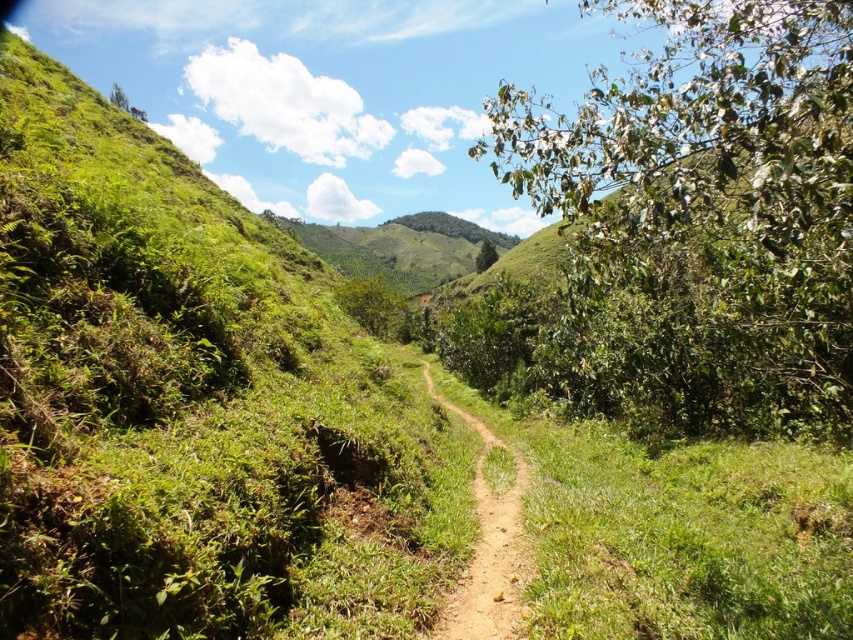
Can you confirm if brown dirt track at center is shorter than green leafy hill at center?

Yes, brown dirt track at center is shorter than green leafy hill at center.

Does point (518, 499) lie in front of point (355, 275)?

That is True.

Which is in front, point (480, 588) or point (277, 221)?

Point (480, 588)

Where is `brown dirt track at center`? The height and width of the screenshot is (640, 853). brown dirt track at center is located at coordinates (488, 547).

Is point (643, 397) in front of point (366, 260)?

Yes, it is.

Who is lower down, green leafy bush at right or green leafy hill at center?

green leafy hill at center is below.

Who is more forward, (636,161) or (387,236)?

Point (636,161) is in front.

Find the location of a particular element. The width and height of the screenshot is (853, 640). green leafy bush at right is located at coordinates (701, 218).

This screenshot has width=853, height=640. What do you see at coordinates (701, 218) in the screenshot?
I see `green leafy bush at right` at bounding box center [701, 218].

Who is shorter, green leafy bush at right or brown dirt track at center?

brown dirt track at center is shorter.

Identify the location of green leafy bush at right. (701, 218).